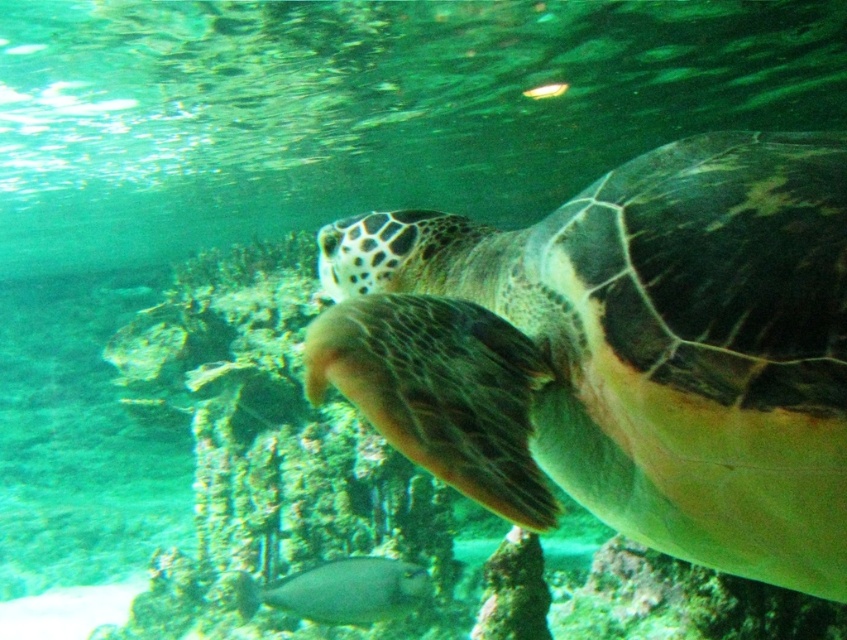
You are a marine biologist observing the underwater scene. You notice the green matte turtle at center and the shiny silver fish at center. Which of these two animals is larger in size?

The green matte turtle at center is bigger than the shiny silver fish at center, so the turtle is larger in size.

You are a marine biologist studying underwater life. You observe the green matte turtle at center in an underwater scene. Based on its coordinates, can you determine if it is closer to the bottom or the top of the image?

The green matte turtle at center is positioned at coordinates point (623,352). Since the y coordinate is 0.736, which is closer to 1.0, it is closer to the bottom of the image.

You are a marine biologist observing the underwater scene. You notice the green matte turtle at center and the shiny silver fish at center. Which one appears closer to you in the image?

The green matte turtle at center is in front of the shiny silver fish at center, so it appears closer to you.